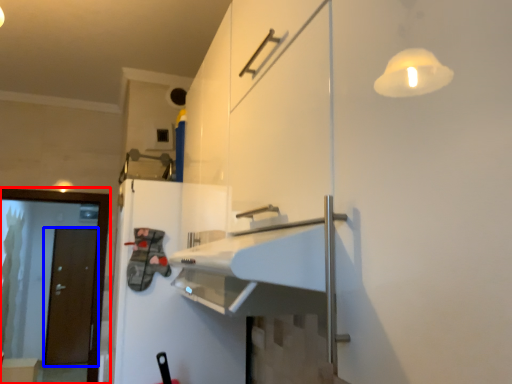
Question: Which of the following is the farthest to the observer, screen door (highlighted by a red box) or door (highlighted by a blue box)?

Choices:
 (A) screen door
 (B) door

Answer: (B)